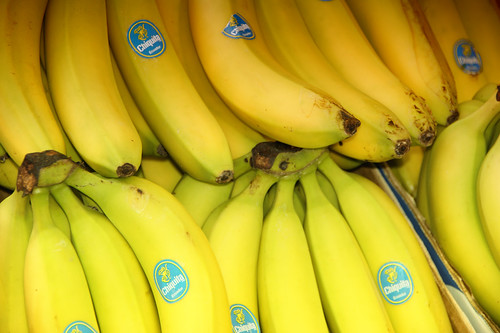
What are the coordinates of `sticker` in the screenshot? It's located at (158, 39), (242, 35), (168, 281), (241, 318), (75, 326), (387, 277), (463, 62).